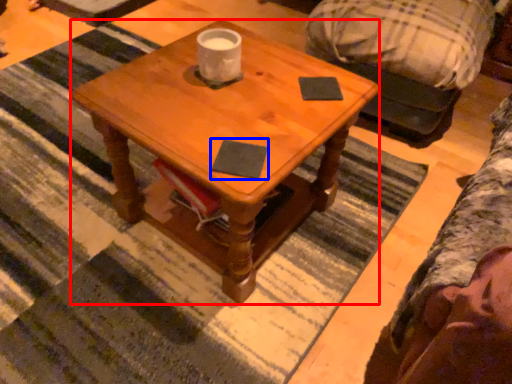
Question: Which object appears farthest to the camera in this image, coffee table (highlighted by a red box) or notepad (highlighted by a blue box)?

Choices:
 (A) coffee table
 (B) notepad

Answer: (B)